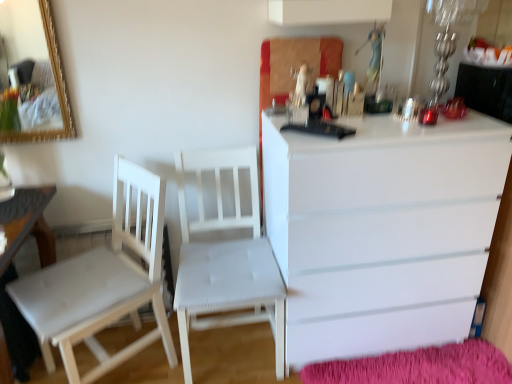
Question: In the image, is fuzzy pink mat at lower right positioned in front of or behind white glossy chest of drawers at right?

Choices:
 (A) behind
 (B) front

Answer: (A)

Question: Is fuzzy pink mat at lower right to the left or to the right of white glossy chest of drawers at right in the image?

Choices:
 (A) left
 (B) right

Answer: (B)

Question: Estimate the real-world distances between objects in this image. Which object is farther from the white wood chair at center, arranged as the first chair when viewed from the left?

Choices:
 (A) white fabric chair at center, acting as the 2th chair starting from the left
 (B) fuzzy pink mat at lower right
 (C) white glossy chest of drawers at right
 (D) white wood table at lower left

Answer: (B)

Question: Considering the real-world distances, which object is closest to the white glossy chest of drawers at right?

Choices:
 (A) white wood table at lower left
 (B) white fabric chair at center, the 1th chair from the right
 (C) fuzzy pink mat at lower right
 (D) white wood chair at center, arranged as the first chair when viewed from the left

Answer: (C)